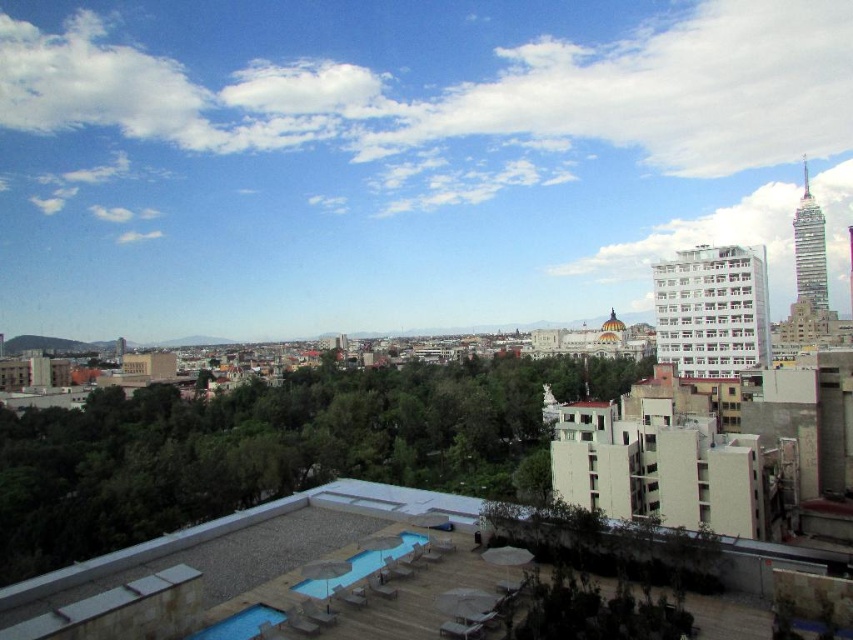
Question: Is blue smooth pool at lower center thinner than blue smooth pool at lower left?

Choices:
 (A) no
 (B) yes

Answer: (A)

Question: Which point is closer to the camera taking this photo?

Choices:
 (A) (230, 620)
 (B) (422, 532)

Answer: (A)

Question: Which point is closer to the camera taking this photo?

Choices:
 (A) (345, 577)
 (B) (225, 636)

Answer: (B)

Question: Which point is closer to the camera?

Choices:
 (A) blue smooth pool at lower center
 (B) blue smooth pool at lower left

Answer: (B)

Question: Is blue smooth pool at lower center further to camera compared to blue smooth pool at lower left?

Choices:
 (A) yes
 (B) no

Answer: (A)

Question: Can you confirm if blue smooth pool at lower center is positioned to the right of blue smooth pool at lower left?

Choices:
 (A) no
 (B) yes

Answer: (B)